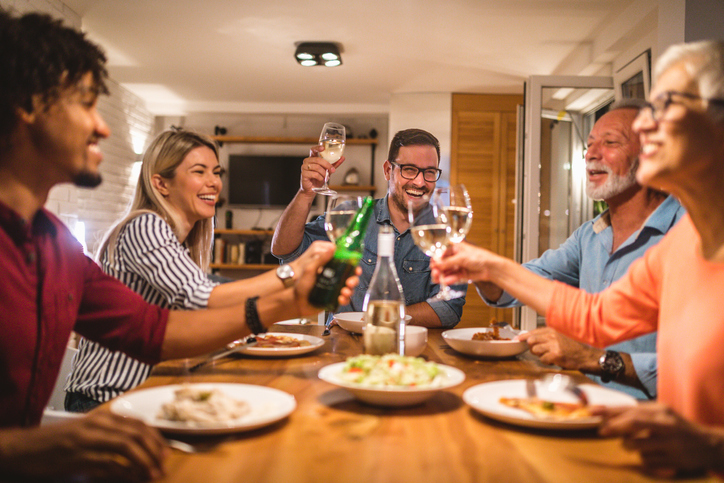
The height and width of the screenshot is (483, 724). Identify the location of dishes on table. (264, 412), (362, 390), (500, 392), (473, 345), (411, 334), (350, 321), (290, 352).